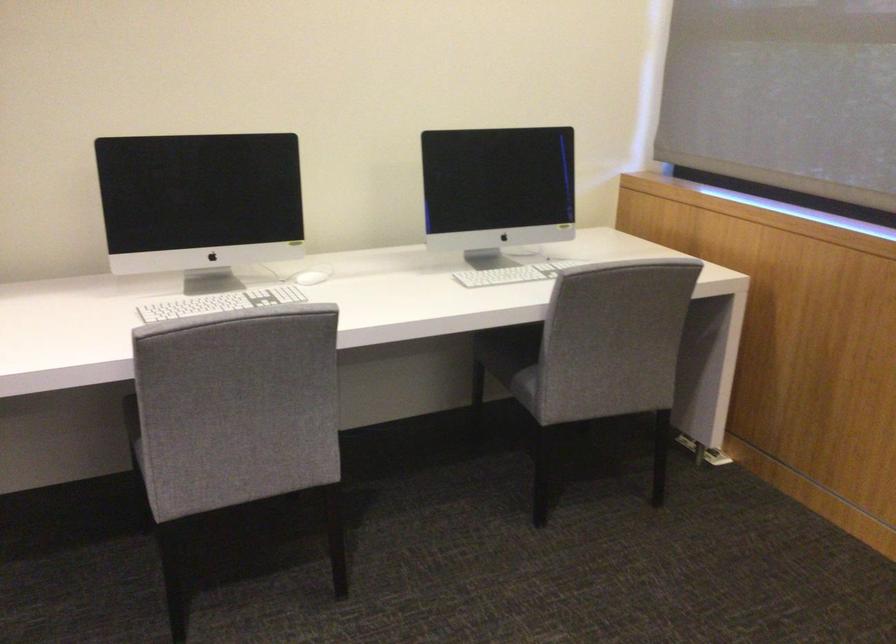
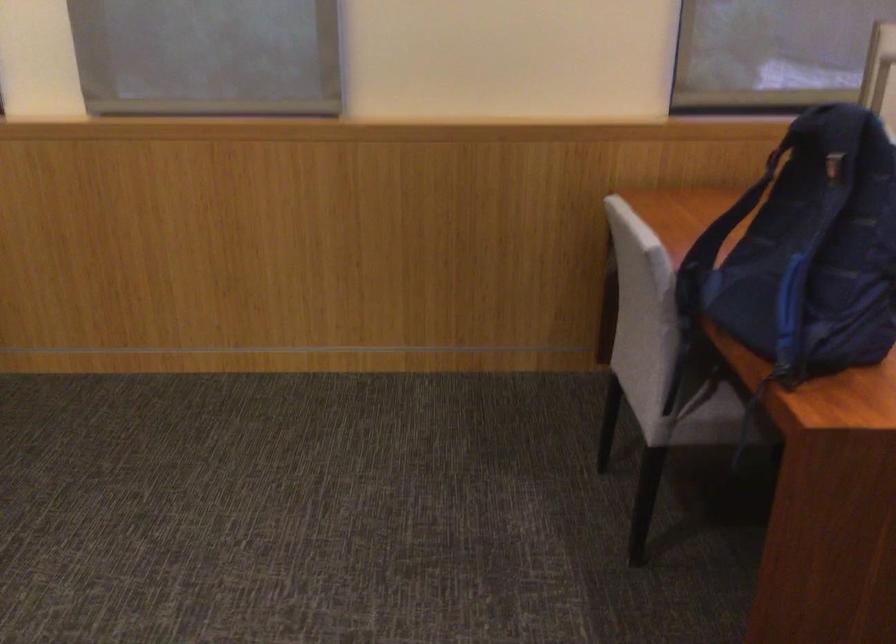
Question: Based on the continuous images, in which direction is the camera rotating? Reply with the corresponding letter.

Choices:
 (A) Left
 (B) Right
 (C) Up
 (D) Down

Answer: (B)